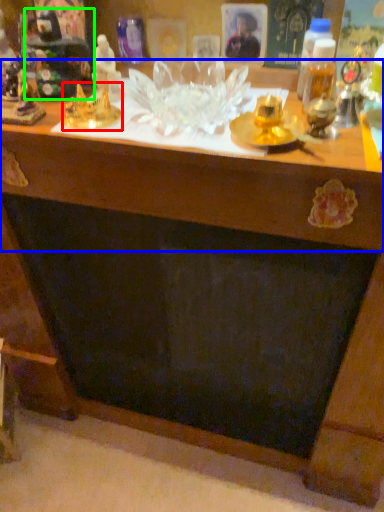
Question: Considering the real-world distances, which object is closest to toy (highlighted by a red box)? table (highlighted by a blue box) or toy (highlighted by a green box).

Choices:
 (A) table
 (B) toy

Answer: (B)